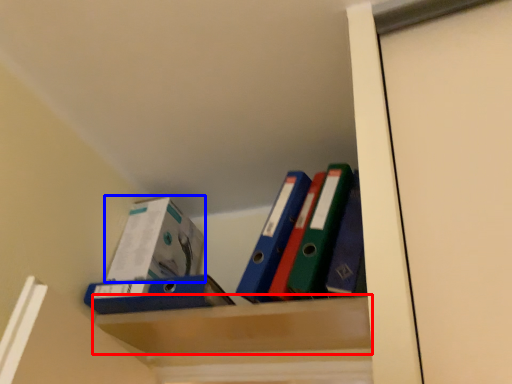
Question: Which object appears farthest to the camera in this image, cabinet (highlighted by a red box) or box (highlighted by a blue box)?

Choices:
 (A) cabinet
 (B) box

Answer: (B)